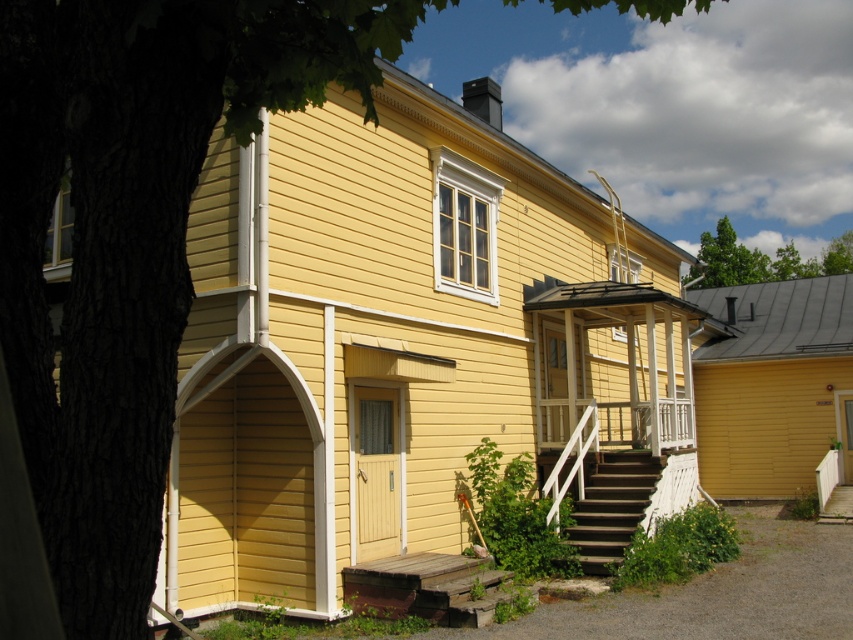
Question: Does dark brown wooden stairs at lower center appear under green leafy tree at upper center?

Choices:
 (A) no
 (B) yes

Answer: (B)

Question: Which object is closer to the camera taking this photo?

Choices:
 (A) green leafy tree at upper center
 (B) dark brown wooden stairs at lower center

Answer: (B)

Question: Is dark brown wooden stairs at lower center in front of green leafy tree at upper center?

Choices:
 (A) yes
 (B) no

Answer: (A)

Question: Which of the following is the closest to the observer?

Choices:
 (A) (616, 465)
 (B) (767, 253)

Answer: (A)

Question: In this image, where is dark brown wooden stairs at lower center located relative to green leafy tree at upper center?

Choices:
 (A) below
 (B) above

Answer: (A)